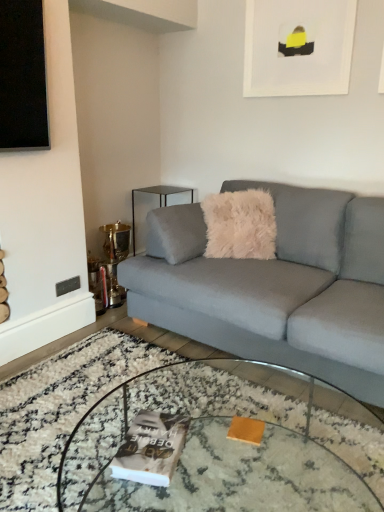
Locate an element on the screen. This screenshot has width=384, height=512. free space to the left of matte gray magazine at center is located at coordinates (89, 453).